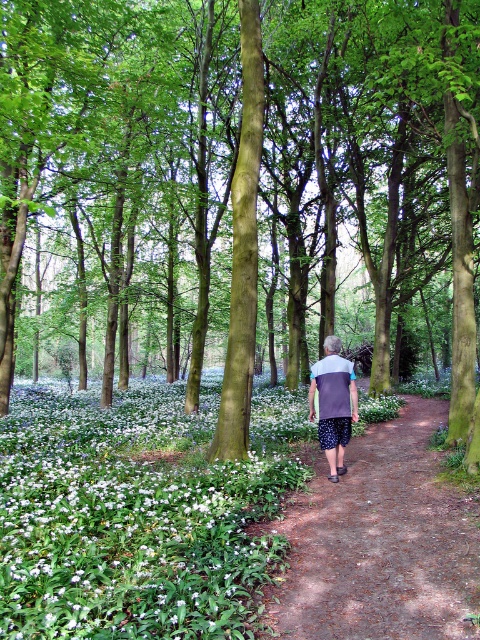
In the scene shown: Between white matte flowers at lower left and gray fabric shirt at center, which one is positioned higher?

gray fabric shirt at center is higher up.

Find the location of a particular element. white matte flowers at lower left is located at coordinates (139, 513).

The image size is (480, 640). In order to click on green smooth tree trunk at center in this screenshot , I will do `click(243, 168)`.

Is green smooth tree trunk at center wider than brown dirt path at center?

Yes, green smooth tree trunk at center is wider than brown dirt path at center.

Is point (34, 108) less distant than point (477, 584)?

No.

Where is `green smooth tree trunk at center`? green smooth tree trunk at center is located at coordinates (243, 168).

Which of these two, green smooth tree trunk at center or white matte flowers at lower left, stands taller?

green smooth tree trunk at center is taller.

Who is lower down, green smooth tree trunk at center or white matte flowers at lower left?

white matte flowers at lower left

Identify the location of green smooth tree trunk at center. This screenshot has height=640, width=480. (243, 168).

The width and height of the screenshot is (480, 640). Find the location of `green smooth tree trunk at center`. green smooth tree trunk at center is located at coordinates (243, 168).